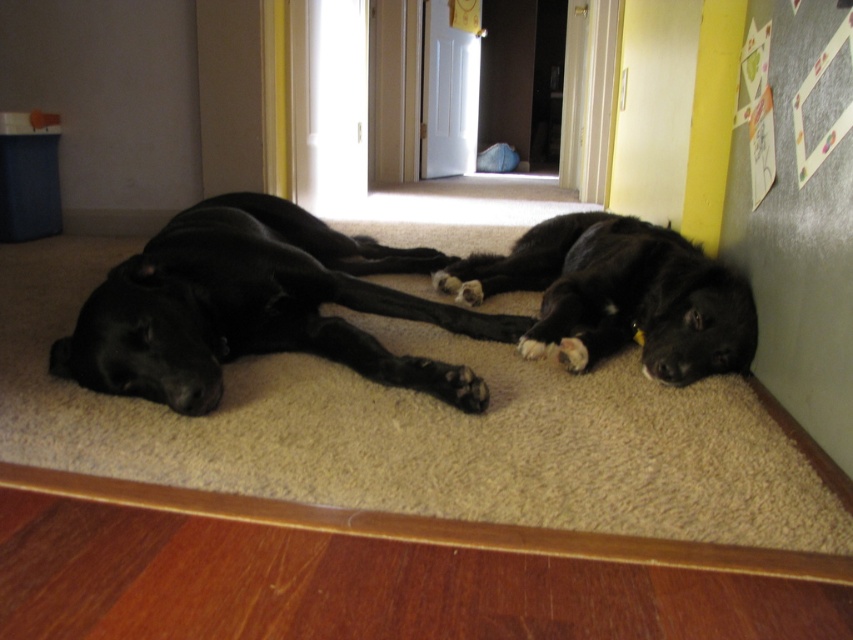
Describe the element at coordinates (259, 307) in the screenshot. This screenshot has width=853, height=640. I see `black smooth dog at center` at that location.

The image size is (853, 640). What do you see at coordinates (259, 307) in the screenshot?
I see `black smooth dog at center` at bounding box center [259, 307].

Locate an element on the screen. The width and height of the screenshot is (853, 640). black smooth dog at center is located at coordinates (259, 307).

Can you confirm if black smooth dog at center is thinner than white paperboard at lower right?

In fact, black smooth dog at center might be wider than white paperboard at lower right.

Between black smooth dog at center and white paperboard at lower right, which one has less height?

With less height is black smooth dog at center.

Image resolution: width=853 pixels, height=640 pixels. What do you see at coordinates (259, 307) in the screenshot? I see `black smooth dog at center` at bounding box center [259, 307].

Locate an element on the screen. black smooth dog at center is located at coordinates (259, 307).

Is beige carpet at center smaller than white paperboard at lower right?

No, beige carpet at center is not smaller than white paperboard at lower right.

Can you confirm if beige carpet at center is positioned below white paperboard at lower right?

Yes, beige carpet at center is below white paperboard at lower right.

Image resolution: width=853 pixels, height=640 pixels. I want to click on beige carpet at center, so click(x=418, y=432).

What are the coordinates of `beige carpet at center` in the screenshot? It's located at (418, 432).